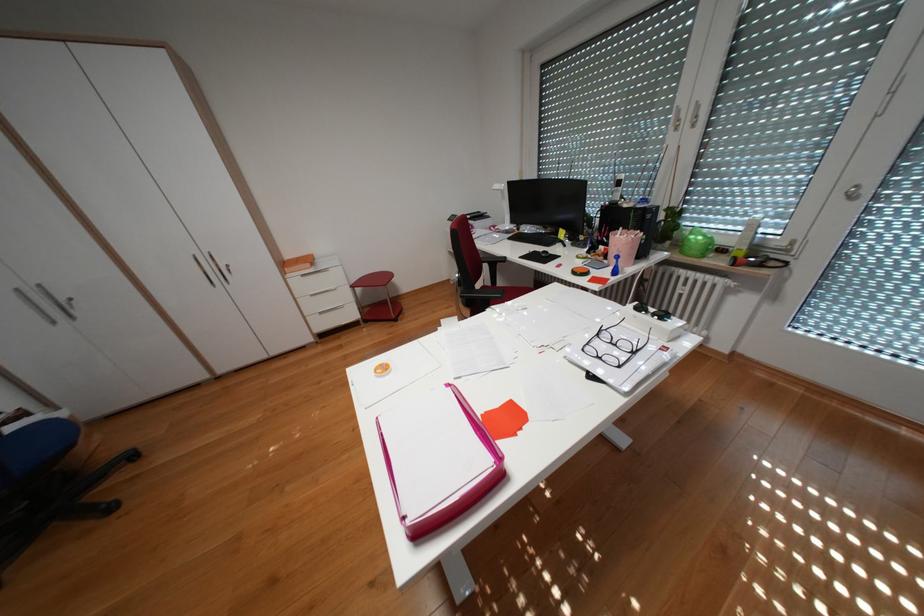
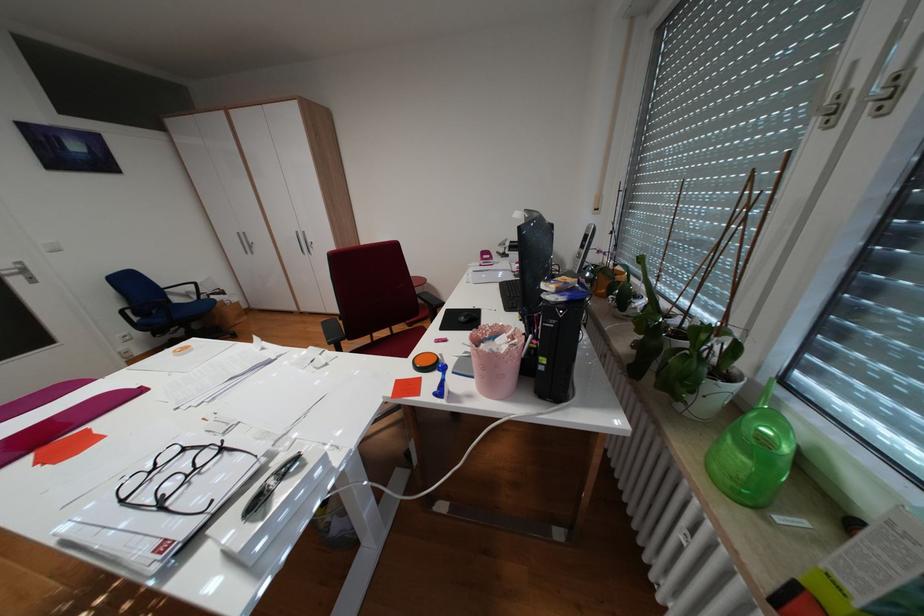
Locate, in the second image, the point that corresponds to the point at 647,352 in the first image.

(173, 505)